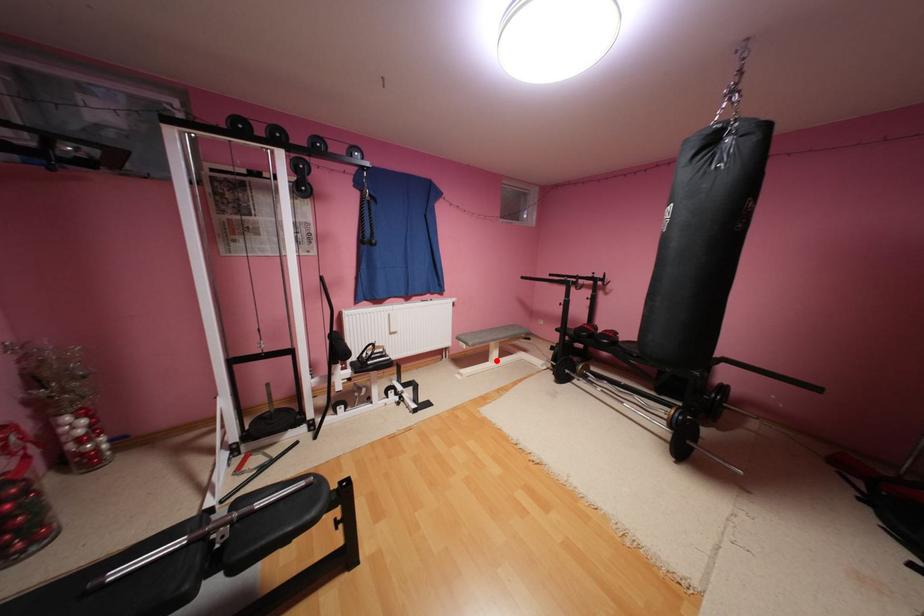
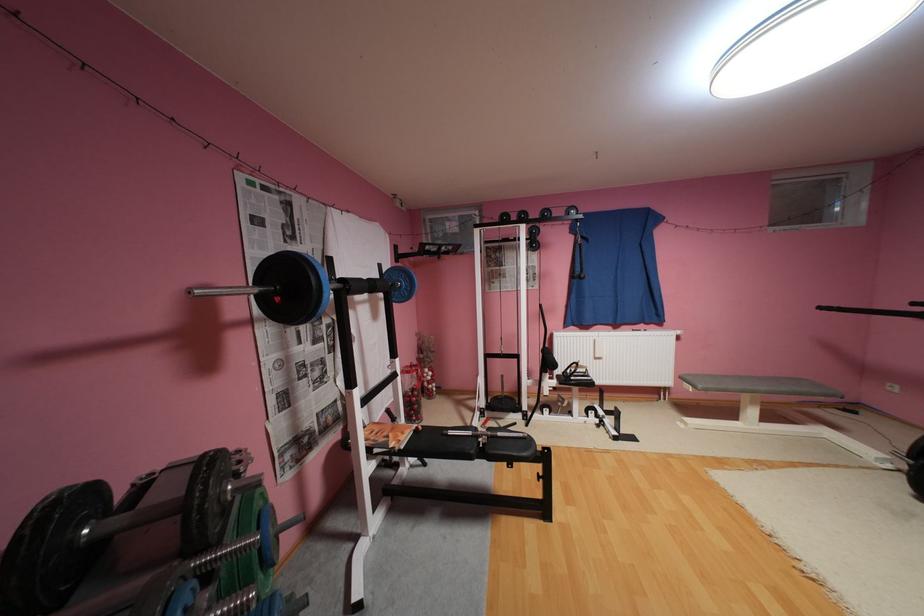
Question: A red point is marked in image1. In image2, is the corresponding 3D point closer to the camera or farther? Reply with the corresponding letter.

Choices:
 (A) The corresponding 3D point is closer.
 (B) The corresponding 3D point is farther.

Answer: (A)